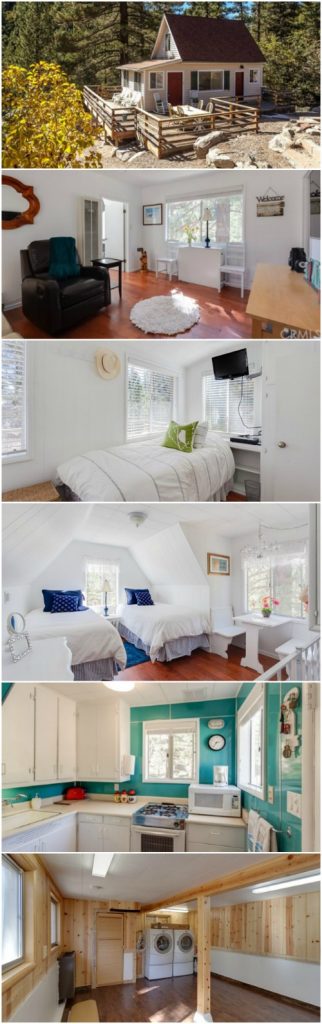
I want to click on windows fourth image, so click(181, 762), click(154, 757), click(241, 752), click(256, 758).